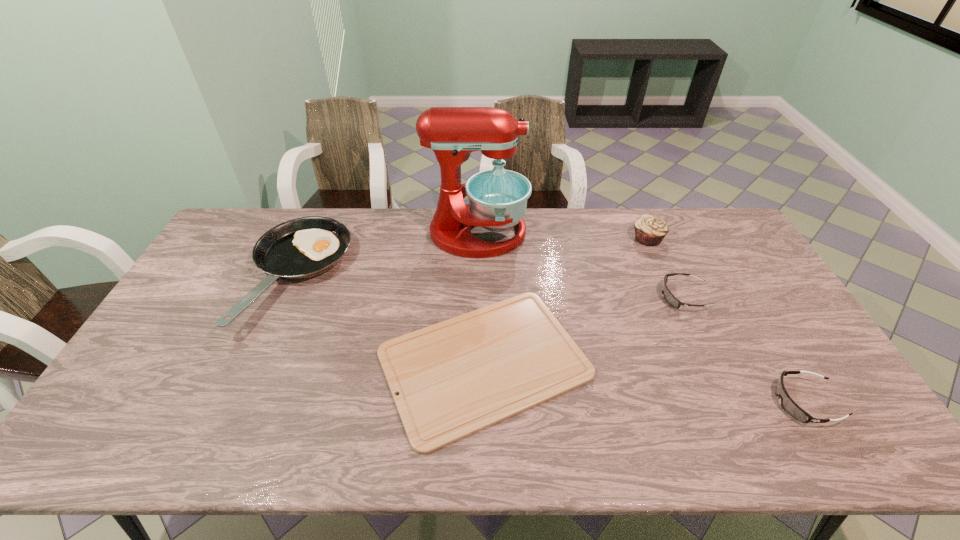
You are a GUI agent. You are given a task and a screenshot of the screen. Output one action in this format:
    pyautogui.click(x=<x>, y=<y>)
    Task: Click on the unoccupied area between the fourth shortest object and the left goggles
    Image resolution: width=960 pixels, height=540 pixels.
    Given the screenshot: What is the action you would take?
    pyautogui.click(x=491, y=287)

Locate an element on the screen. The width and height of the screenshot is (960, 540). vacant area between the farther goggles and the chopping board is located at coordinates (585, 329).

Locate an element on the screen. The height and width of the screenshot is (540, 960). free spot between the muffin and the chopping board is located at coordinates (565, 300).

You are a GUI agent. You are given a task and a screenshot of the screen. Output one action in this format:
    pyautogui.click(x=<x>, y=<y>)
    Task: Click on the free space between the shortest object and the second tallest object
    The image size is (960, 540).
    Given the screenshot: What is the action you would take?
    pyautogui.click(x=565, y=300)

The image size is (960, 540). Identify the location of empty space that is in between the farther goggles and the fifth shortest object. (666, 267).

Locate an element on the screen. The width and height of the screenshot is (960, 540). unoccupied position between the right goggles and the left goggles is located at coordinates (745, 349).

Find the location of a particular element. The height and width of the screenshot is (540, 960). free spot between the shortest object and the tallest object is located at coordinates (481, 298).

Point out which object is positioned as the fifth nearest to the shortest object. Please provide its 2D coordinates. Your answer should be formatted as a tuple, i.e. [(x, y)], where the tuple contains the x and y coordinates of a point satisfying the conditions above.

[(790, 407)]

Identify the location of object that is the second closest one to the leftmost object. (498, 198).

Locate an element on the screen. The image size is (960, 540). vacant area that satisfies the following two spatial constraints: 1. on the back side of the frying pan; 2. on the left side of the fifth shortest object is located at coordinates (313, 238).